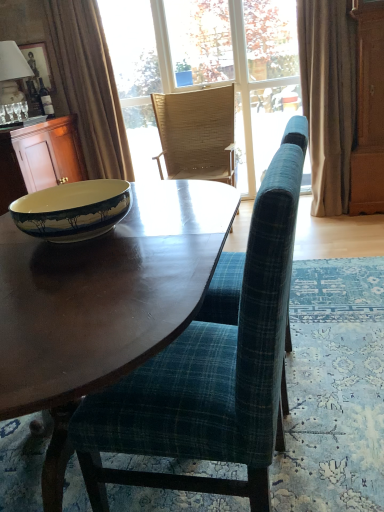
Question: Based on their positions, is wooden cabinet at left located to the left or right of brown fabric curtain at upper left, which is the first curtain in left-to-right order?

Choices:
 (A) right
 (B) left

Answer: (B)

Question: From a real-world perspective, is wooden cabinet at left positioned above or below brown fabric curtain at upper left, the 2th curtain in the right-to-left sequence?

Choices:
 (A) above
 (B) below

Answer: (B)

Question: Considering the real-world distances, which object is closest to the beige fabric curtain at right, the 1th curtain from the right?

Choices:
 (A) brown fabric curtain at upper left, the 2th curtain in the right-to-left sequence
 (B) woven wood chair at center, placed as the first chair when sorted from top to bottom
 (C) wooden desk at center
 (D) wooden picture frame at upper left
 (E) matte glass bottle at upper left

Answer: (B)

Question: Which is farther from the wooden picture frame at upper left?

Choices:
 (A) wooden cabinet at left
 (B) matte glass bottle at upper left
 (C) white fabric lampshade at upper left
 (D) matte ceramic bowl at left
 (E) beige fabric curtain at right, the 1th curtain from the right

Answer: (D)